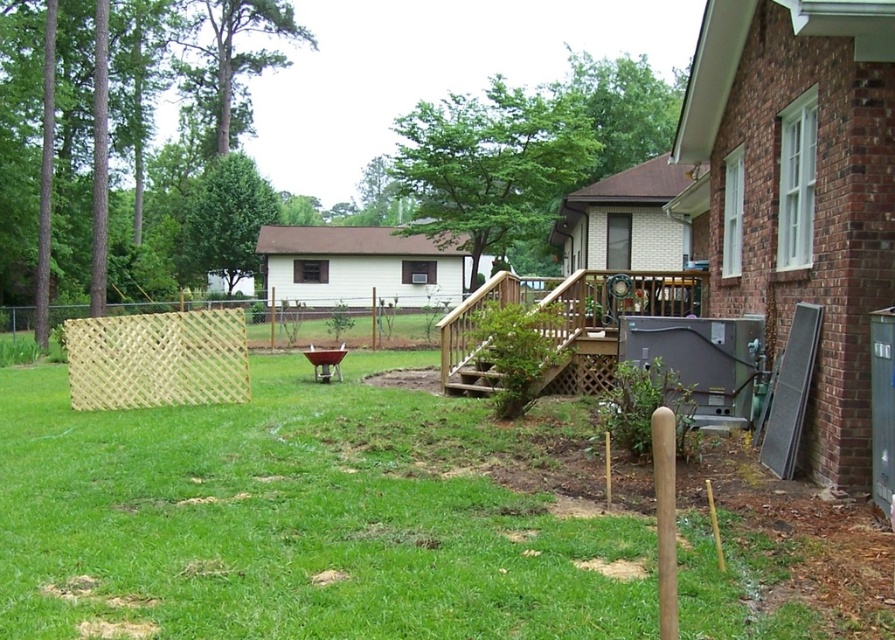
Can you confirm if light brown lattice fence at lower left is positioned to the right of brown wooden porch at center?

No, light brown lattice fence at lower left is not to the right of brown wooden porch at center.

Can you confirm if light brown lattice fence at lower left is taller than brown wooden porch at center?

Indeed, light brown lattice fence at lower left has a greater height compared to brown wooden porch at center.

This screenshot has height=640, width=895. In order to click on light brown lattice fence at lower left in this screenshot , I will do `click(158, 358)`.

From the picture: Which is above, brown wooden porch at center or brown wooden stairs at center?

brown wooden porch at center

Looking at this image, can you confirm if brown wooden porch at center is wider than brown wooden stairs at center?

Yes.

The width and height of the screenshot is (895, 640). What do you see at coordinates (558, 314) in the screenshot?
I see `brown wooden porch at center` at bounding box center [558, 314].

This screenshot has width=895, height=640. In order to click on brown wooden porch at center in this screenshot , I will do `click(558, 314)`.

Which is in front, point (235, 340) or point (506, 355)?

Point (506, 355) is in front.

Who is higher up, light brown lattice fence at lower left or brown wooden stairs at center?

brown wooden stairs at center is higher up.

At what (x,y) coordinates should I click in order to perform the action: click on light brown lattice fence at lower left. Please return your answer as a coordinate pair (x, y). The image size is (895, 640). Looking at the image, I should click on (158, 358).

Find the location of a particular element. This screenshot has width=895, height=640. light brown lattice fence at lower left is located at coordinates (158, 358).